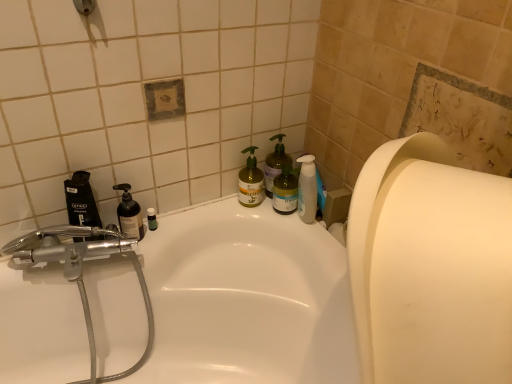
Find the location of a particular element. The height and width of the screenshot is (384, 512). vacant space positioned to the left of green matte bottle at center, the second cleaning product viewed from the right is located at coordinates (207, 215).